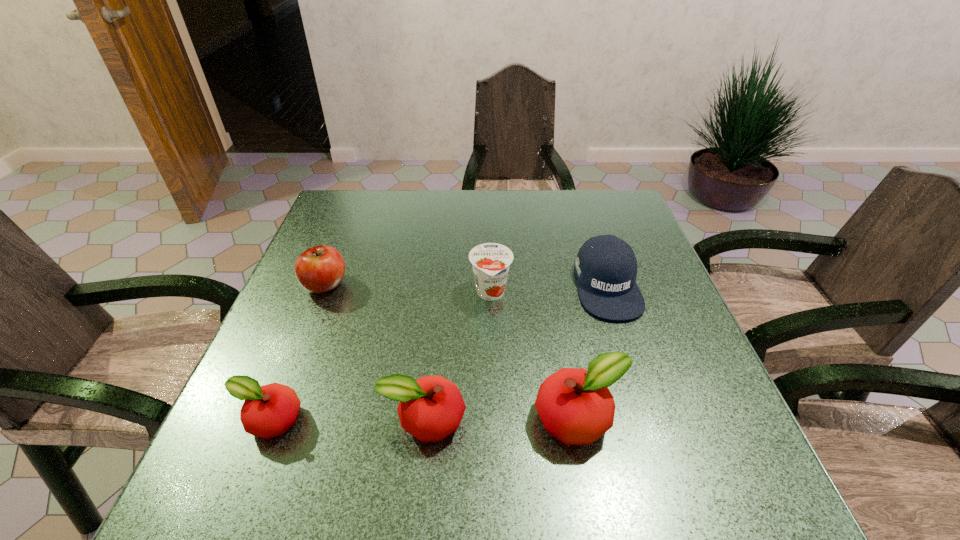
Find the location of a particular element. This screenshot has height=540, width=960. the shortest object is located at coordinates (268, 411).

At what (x,y) coordinates should I click in order to perform the action: click on the third apple from left to right. Please return your answer as a coordinate pair (x, y). This screenshot has height=540, width=960. Looking at the image, I should click on (430, 408).

I want to click on the rightmost apple, so click(x=576, y=407).

The height and width of the screenshot is (540, 960). I want to click on yogurt, so click(490, 261).

The height and width of the screenshot is (540, 960). I want to click on the farthest apple, so click(x=319, y=269).

This screenshot has width=960, height=540. What are the coordinates of `baseball cap` in the screenshot? It's located at (606, 266).

Identify the location of blank space located on the right of the shortest apple. (511, 420).

This screenshot has width=960, height=540. Find the location of `vacant area situated on the back of the third apple from left to right`. vacant area situated on the back of the third apple from left to right is located at coordinates (441, 264).

Locate an element on the screen. free space located 0.270m on the back of the rightmost apple is located at coordinates (555, 293).

Locate an element on the screen. Image resolution: width=960 pixels, height=540 pixels. vacant position located on the back of the yogurt is located at coordinates (489, 221).